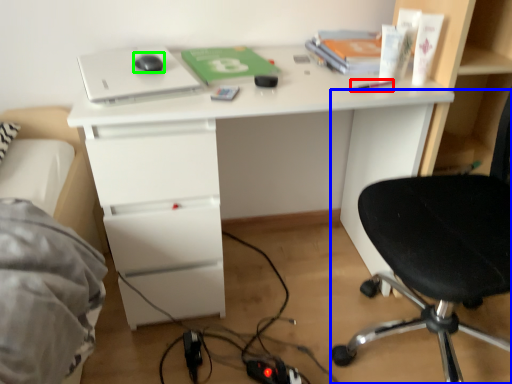
Question: Which is nearer to the stationery (highlighted by a red box)? chair (highlighted by a blue box) or mouse (highlighted by a green box).

Choices:
 (A) chair
 (B) mouse

Answer: (A)